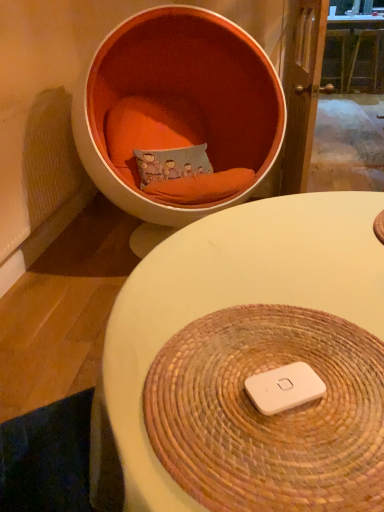
This screenshot has width=384, height=512. Describe the element at coordinates (172, 163) in the screenshot. I see `textured fabric pillow at center` at that location.

The width and height of the screenshot is (384, 512). What do you see at coordinates (182, 103) in the screenshot?
I see `orange fabric chair at upper left` at bounding box center [182, 103].

This screenshot has width=384, height=512. I want to click on wooden table at upper center, the 2th table positioned from the bottom, so click(x=355, y=52).

Identify the location of white matte/ipod at center. (284, 388).

From the picture: From the image's perspective, relative to wooden table at upper center, the 1th table from the top, is white matte/ipod at center above or below?

white matte/ipod at center is situated lower than wooden table at upper center, the 1th table from the top, in the image.

Which is more to the right, white matte/ipod at center or wooden table at upper center, the 2th table from the left?

Positioned to the right is wooden table at upper center, the 2th table from the left.

Considering the relative sizes of white matte/ipod at center and wooden table at upper center, which appears as the 2th table when viewed from the front, in the image provided, is white matte/ipod at center wider than wooden table at upper center, which appears as the 2th table when viewed from the front,?

Incorrect, the width of white matte/ipod at center does not surpass that of wooden table at upper center, which appears as the 2th table when viewed from the front.

How many degrees apart are the facing directions of white matte/ipod at center and wooden table at upper center, placed as the first table when sorted from back to front?

There is a 29.3-degree angle between the facing directions of white matte/ipod at center and wooden table at upper center, placed as the first table when sorted from back to front.

Is white woven placemat at center, arranged as the first table when viewed from the front, facing towards white matte/ipod at center?

Yes, white woven placemat at center, arranged as the first table when viewed from the front, is facing white matte/ipod at center.

From the image's perspective, is white woven placemat at center, arranged as the first table when viewed from the front, on white matte/ipod at center?

No.

Can you confirm if white woven placemat at center, arranged as the 1th table when viewed from the left, is taller than white matte/ipod at center?

Indeed, white woven placemat at center, arranged as the 1th table when viewed from the left, has a greater height compared to white matte/ipod at center.

Is white woven placemat at center, which ranks as the 2th table in right-to-left order, to the right of white matte/ipod at center from the viewer's perspective?

Correct, you'll find white woven placemat at center, which ranks as the 2th table in right-to-left order, to the right of white matte/ipod at center.

In the scene shown: Considering the relative sizes of white matte/ipod at center and orange fabric chair at upper left in the image provided, is white matte/ipod at center shorter than orange fabric chair at upper left?

Yes.

From the image's perspective, is white matte/ipod at center positioned above or below orange fabric chair at upper left?

From the image's perspective, white matte/ipod at center appears below orange fabric chair at upper left.

Looking at this image, is white matte/ipod at center to the right of orange fabric chair at upper left from the viewer's perspective?

Yes.

Which is less distant, (321, 389) or (154, 77)?

Clearly, point (321, 389) is closer to the camera than point (154, 77).

Is white woven placemat at center, which is the 2th table from top to bottom, further to the viewer compared to orange fabric chair at upper left?

No, the depth of white woven placemat at center, which is the 2th table from top to bottom, is less than that of orange fabric chair at upper left.

Which of these two, white woven placemat at center, which ranks as the 2th table in right-to-left order, or orange fabric chair at upper left, is smaller?

With smaller size is white woven placemat at center, which ranks as the 2th table in right-to-left order.

Does white woven placemat at center, which ranks as the 2th table in right-to-left order, turn towards orange fabric chair at upper left?

No, white woven placemat at center, which ranks as the 2th table in right-to-left order, is not turned towards orange fabric chair at upper left.

From a real-world perspective, which object stands above the other?

white woven placemat at center, marked as the 1th table in a bottom-to-top arrangement.

Considering the relative positions of orange fabric chair at upper left and textured fabric pillow at center in the image provided, is orange fabric chair at upper left in front of textured fabric pillow at center?

Yes, orange fabric chair at upper left is in front of textured fabric pillow at center.

Is orange fabric chair at upper left at the left side of textured fabric pillow at center?

No.

In terms of height, does orange fabric chair at upper left look taller or shorter compared to textured fabric pillow at center?

orange fabric chair at upper left is taller than textured fabric pillow at center.

Is point (94, 153) positioned after point (147, 160)?

No, (94, 153) is in front of (147, 160).

Is wooden table at upper center, the 1th table from the top, in contact with white woven placemat at center, which is the 2th table from top to bottom?

wooden table at upper center, the 1th table from the top, and white woven placemat at center, which is the 2th table from top to bottom, are not in contact.

Is wooden table at upper center, the 2th table positioned from the bottom, shorter than white woven placemat at center, arranged as the 1th table when viewed from the left?

In fact, wooden table at upper center, the 2th table positioned from the bottom, may be taller than white woven placemat at center, arranged as the 1th table when viewed from the left.

Image resolution: width=384 pixels, height=512 pixels. In order to click on table on the left of the wooden table at upper center, the 2th table positioned from the bottom in this screenshot , I will do `click(231, 303)`.

What's the angular difference between textured fabric pillow at center and white woven placemat at center, which ranks as the 2th table in right-to-left order,'s facing directions?

90.1 degrees.

Considering the positions of points (166, 174) and (383, 298), is point (166, 174) farther from camera compared to point (383, 298)?

Yes, point (166, 174) is behind point (383, 298).

Is textured fabric pillow at center facing away from white woven placemat at center, which is counted as the second table, starting from the back?

No, white woven placemat at center, which is counted as the second table, starting from the back, is not at the back of textured fabric pillow at center.

Based on the photo, between textured fabric pillow at center and white woven placemat at center, which is the 2th table from top to bottom, which one has more height?

textured fabric pillow at center is taller.

Image resolution: width=384 pixels, height=512 pixels. Identify the location of ipod located on the left of wooden table at upper center, placed as the first table when sorted from back to front. (284, 388).

I want to click on table in front of the white matte/ipod at center, so click(231, 303).

Which object lies further to the anchor point orange fabric chair at upper left, white woven placemat at center, arranged as the first table when viewed from the front, or white matte/ipod at center?

white matte/ipod at center.

Based on their spatial positions, is wooden table at upper center, which appears as the 2th table when viewed from the front, or white matte/ipod at center closer to orange fabric chair at upper left?

Based on the image, white matte/ipod at center appears to be nearer to orange fabric chair at upper left.

Looking at the image, which one is located closer to textured fabric pillow at center, wooden table at upper center, the 1th table from the top, or white woven placemat at center, which is counted as the second table, starting from the back?

white woven placemat at center, which is counted as the second table, starting from the back, lies closer to textured fabric pillow at center than the other object.

Considering their positions, is wooden table at upper center, the 1th table from the top, positioned closer to textured fabric pillow at center than white matte/ipod at center?

white matte/ipod at center.

When comparing their distances from white matte/ipod at center, does white woven placemat at center, marked as the 1th table in a bottom-to-top arrangement, or textured fabric pillow at center seem closer?

The object closer to white matte/ipod at center is white woven placemat at center, marked as the 1th table in a bottom-to-top arrangement.

When comparing their distances from white woven placemat at center, arranged as the first table when viewed from the front, does wooden table at upper center, placed as the first table when sorted from back to front, or white matte/ipod at center seem closer?

The object closer to white woven placemat at center, arranged as the first table when viewed from the front, is white matte/ipod at center.

Consider the image. Which object lies further to the anchor point white woven placemat at center, which is the 2th table from top to bottom, white matte/ipod at center or orange fabric chair at upper left?

orange fabric chair at upper left is positioned further to the anchor white woven placemat at center, which is the 2th table from top to bottom.

Considering their positions, is wooden table at upper center, which is the first table from right to left, positioned further to white woven placemat at center, marked as the 1th table in a bottom-to-top arrangement, than textured fabric pillow at center?

wooden table at upper center, which is the first table from right to left, is positioned further to the anchor white woven placemat at center, marked as the 1th table in a bottom-to-top arrangement.

You are a GUI agent. You are given a task and a screenshot of the screen. Output one action in this format:
    pyautogui.click(x=<x>, y=<y>)
    Task: Click on the ipod located between white woven placemat at center, which is counted as the second table, starting from the back, and orange fabric chair at upper left in the depth direction
    This screenshot has height=512, width=384.
    Given the screenshot: What is the action you would take?
    pyautogui.click(x=284, y=388)

Identify the location of pillow positioned between white woven placemat at center, which is counted as the second table, starting from the back, and wooden table at upper center, placed as the first table when sorted from back to front, from near to far. (172, 163).

The image size is (384, 512). Find the location of `furniture between white matte/ipod at center and textured fabric pillow at center from front to back`. furniture between white matte/ipod at center and textured fabric pillow at center from front to back is located at coordinates (182, 103).

The image size is (384, 512). I want to click on pillow located between white matte/ipod at center and wooden table at upper center, the 2th table from the left, in the depth direction, so click(x=172, y=163).